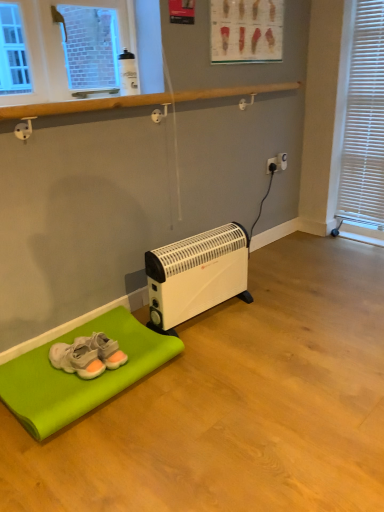
In order to click on free location in front of white plastic heater at lower center in this screenshot , I will do `click(233, 359)`.